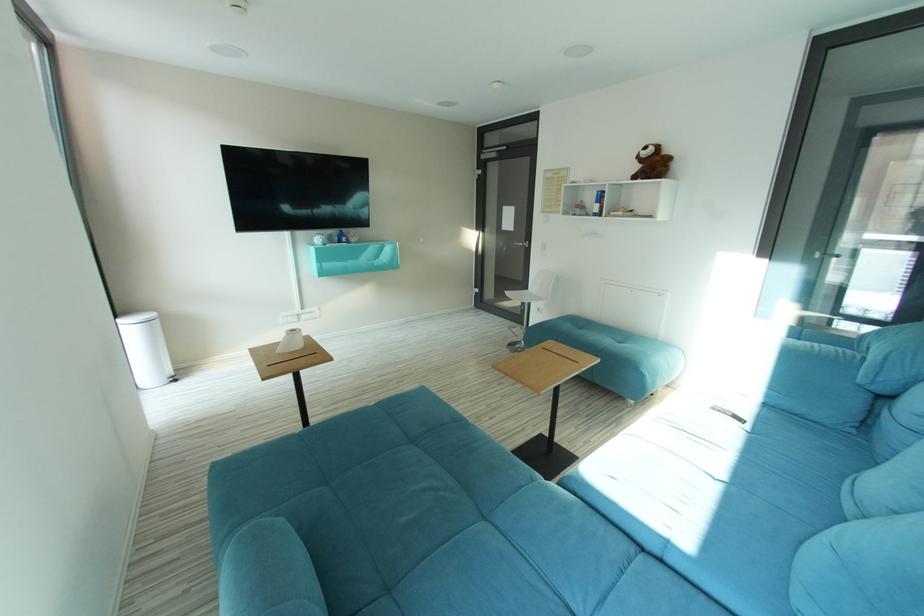
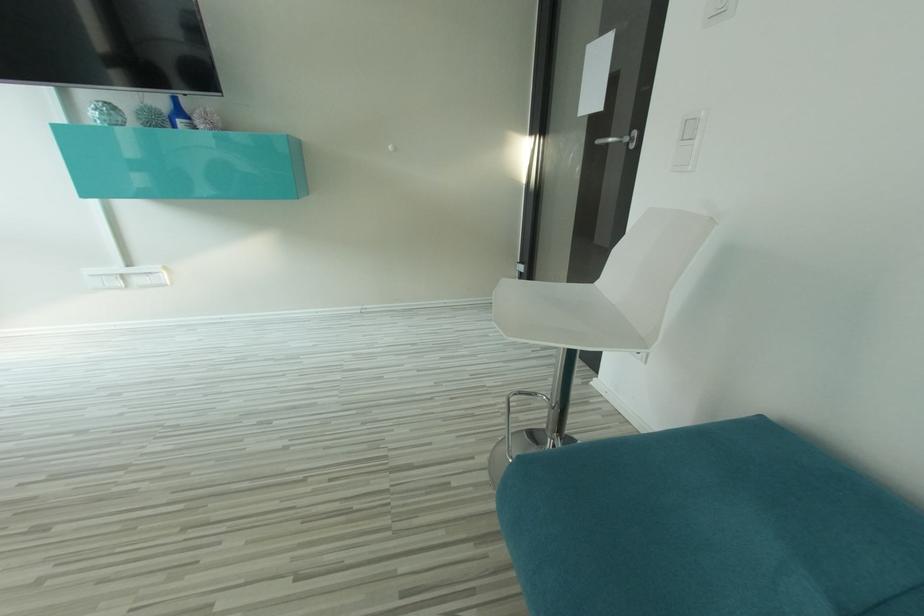
Question: What movement of the cameraman would produce the second image?

Choices:
 (A) Left
 (B) Right
 (C) Forward
 (D) Backward

Answer: (C)